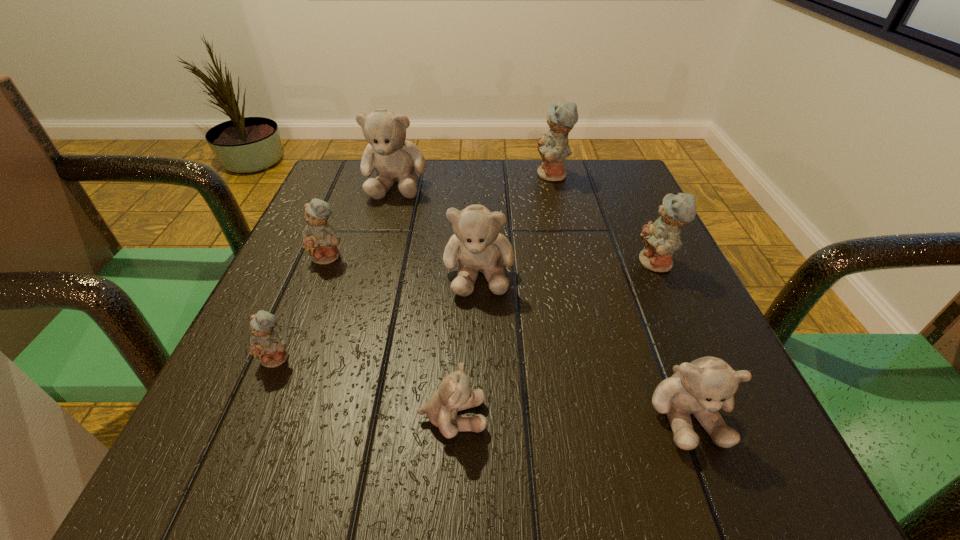
This screenshot has height=540, width=960. Find the location of `blank area located on the front-facing side of the nearest blue teddy bear`. blank area located on the front-facing side of the nearest blue teddy bear is located at coordinates (218, 499).

Identify the location of blank area located 0.140m on the face of the smallest gray teddy bear. The height and width of the screenshot is (540, 960). (592, 417).

At what (x,y) coordinates should I click in order to perform the action: click on object that is at the far left corner. Please return your answer as a coordinate pair (x, y). Looking at the image, I should click on (395, 159).

Where is `object that is at the far right corner`? The image size is (960, 540). object that is at the far right corner is located at coordinates (553, 148).

Find the location of a particular element. This screenshot has height=540, width=960. object that is at the near right corner is located at coordinates (702, 387).

Identify the location of vacant area at the far edge of the desktop. This screenshot has width=960, height=540. (406, 210).

In the image, there is a desktop. In order to click on blank space at the near edge in this screenshot , I will do `click(378, 475)`.

Image resolution: width=960 pixels, height=540 pixels. In order to click on blank space at the left edge of the desktop in this screenshot , I will do `click(239, 355)`.

Image resolution: width=960 pixels, height=540 pixels. In order to click on vacant space at the right edge in this screenshot , I will do `click(710, 321)`.

You are a GUI agent. You are given a task and a screenshot of the screen. Output one action in this format:
    pyautogui.click(x=<x>, y=<y>)
    Task: Click on the vacant area at the far left corner
    This screenshot has width=960, height=540.
    Given the screenshot: What is the action you would take?
    pyautogui.click(x=346, y=184)